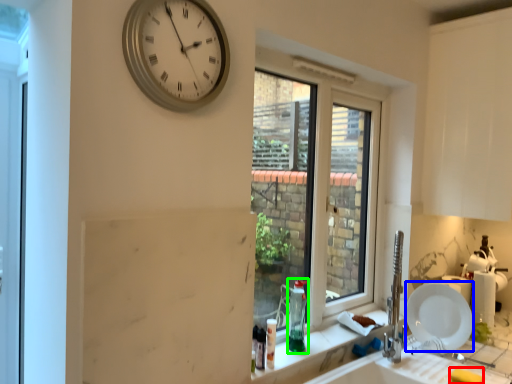
Question: Considering the real-world distances, which object is closest to soap (highlighted by a red box)? plate (highlighted by a blue box) or bottle (highlighted by a green box).

Choices:
 (A) plate
 (B) bottle

Answer: (A)